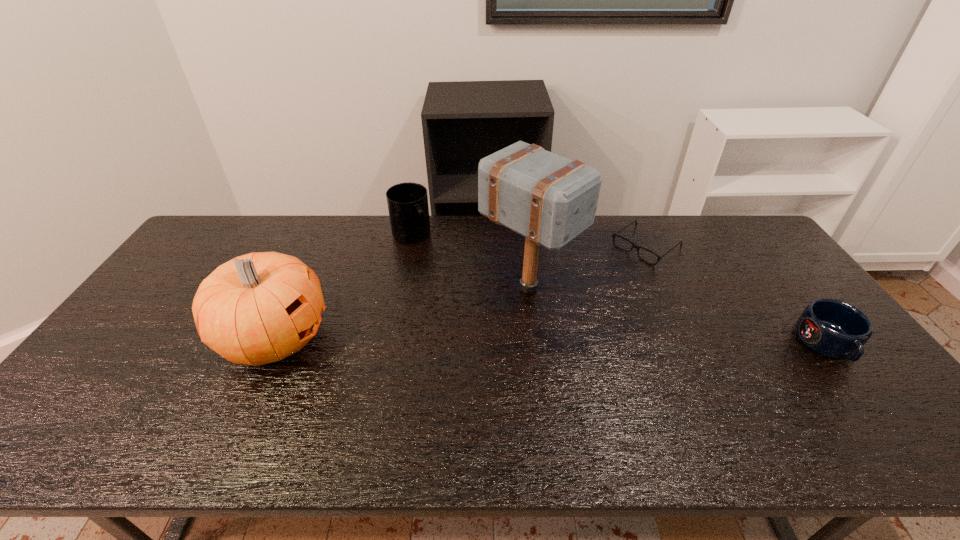
The height and width of the screenshot is (540, 960). I want to click on vacant space that satisfies the following two spatial constraints: 1. on the front side of the taller mug; 2. on the right side of the spectacles, so click(x=409, y=246).